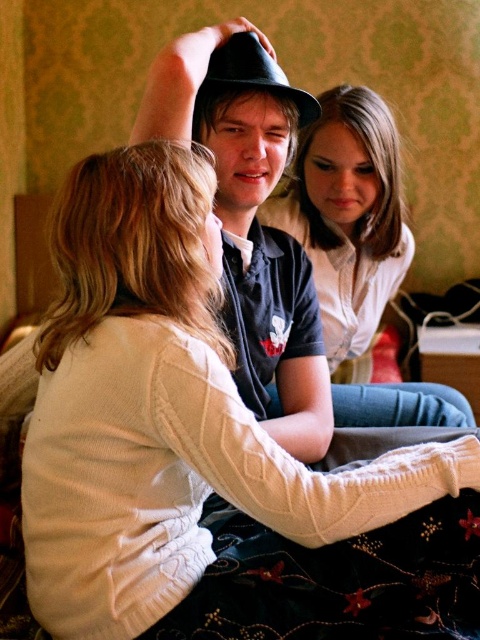
Who is more forward, [300,227] or [273,90]?

Point [273,90] is more forward.

Which of these two, smooth white shirt at center or matte black hat at center, stands shorter?

matte black hat at center is shorter.

Does point (399, 401) come in front of point (275, 68)?

No.

The width and height of the screenshot is (480, 640). What are the coordinates of `smooth white shirt at center` in the screenshot? It's located at (348, 214).